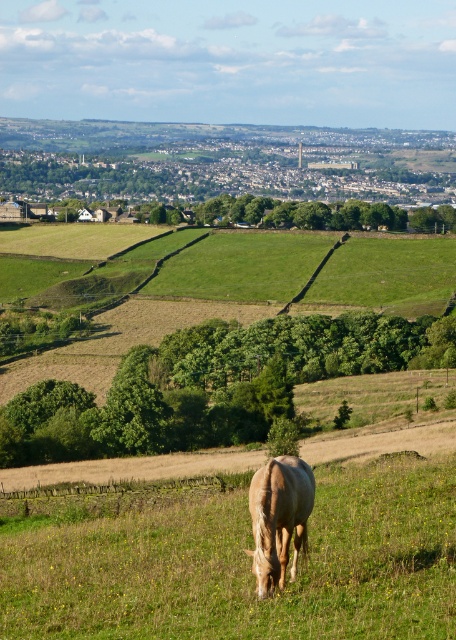
Question: Which of the following is the farthest from the observer?

Choices:
 (A) (268, 566)
 (B) (211, 572)

Answer: (B)

Question: Is green grassy field at center wider than light brown horse at center?

Choices:
 (A) yes
 (B) no

Answer: (A)

Question: Is green grassy field at center thinner than light brown horse at center?

Choices:
 (A) yes
 (B) no

Answer: (B)

Question: Which of the following is the farthest from the observer?

Choices:
 (A) green grassy field at center
 (B) light brown horse at center

Answer: (B)

Question: Does green grassy field at center appear under light brown horse at center?

Choices:
 (A) no
 (B) yes

Answer: (B)

Question: Which point is closer to the camera?

Choices:
 (A) green grassy field at center
 (B) light brown horse at center

Answer: (A)